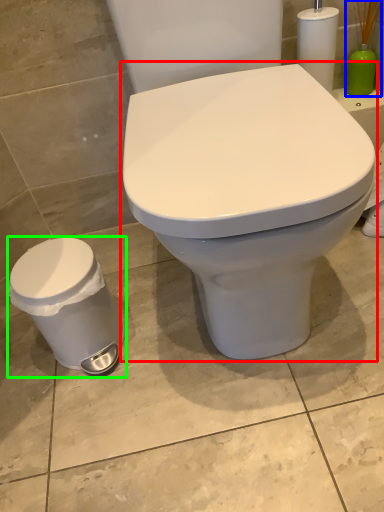
Question: Which object is the farthest from toilet (highlighted by a red box)? Choose among these: brush (highlighted by a blue box) or porcelain (highlighted by a green box).

Choices:
 (A) brush
 (B) porcelain

Answer: (A)